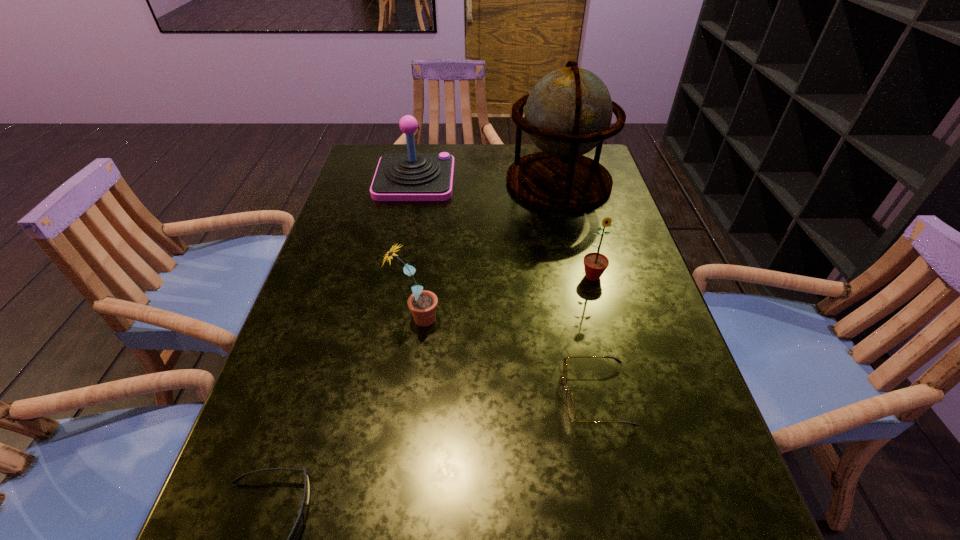
In order to click on globe in this screenshot , I will do `click(568, 113)`.

Identify the location of joystick. (411, 176).

This screenshot has height=540, width=960. Identify the location of the left sunflower. (422, 304).

Image resolution: width=960 pixels, height=540 pixels. Find the location of `the nearer sunflower`. the nearer sunflower is located at coordinates (422, 304).

This screenshot has width=960, height=540. In order to click on the farther sunflower in this screenshot , I will do click(595, 264).

This screenshot has width=960, height=540. I want to click on the fourth nearest object, so click(x=595, y=264).

This screenshot has height=540, width=960. I want to click on the right sunglasses, so click(570, 403).

This screenshot has width=960, height=540. Identify the location of the farther sunglasses. (570, 403).

This screenshot has width=960, height=540. Identify the location of vacant space located on the front-facing side of the globe. (574, 246).

The width and height of the screenshot is (960, 540). I want to click on blank area located forward from the base of the joystick, so click(550, 179).